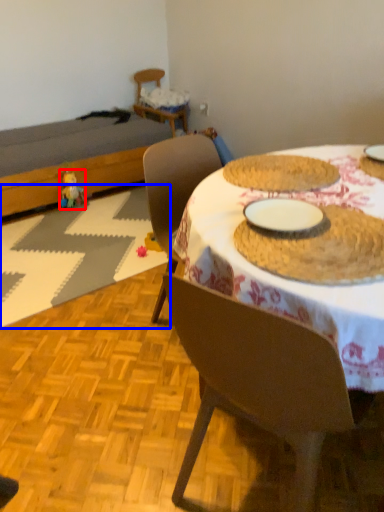
Question: Which of the following is the closest to the observer, toy (highlighted by a red box) or place mat (highlighted by a blue box)?

Choices:
 (A) toy
 (B) place mat

Answer: (B)